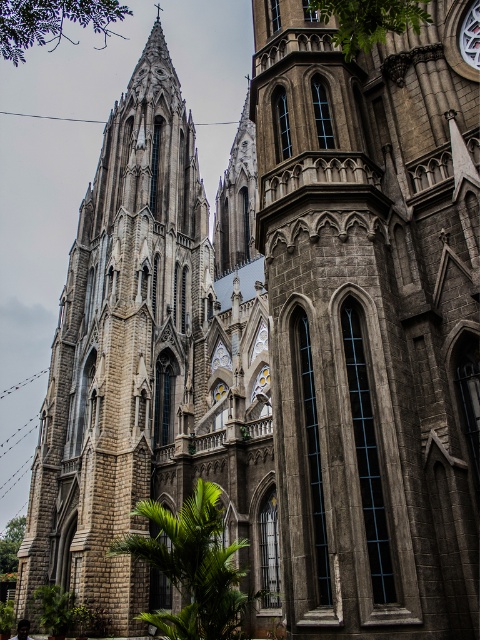
Does gray stone tower at center have a greater width compared to stone tower at left?

In fact, gray stone tower at center might be narrower than stone tower at left.

Does gray stone tower at center have a lesser height compared to stone tower at left?

Indeed, gray stone tower at center has a lesser height compared to stone tower at left.

Who is more distant from viewer, (266, 196) or (180, 100)?

Positioned behind is point (180, 100).

Find the location of a particular element. The height and width of the screenshot is (640, 480). gray stone tower at center is located at coordinates (372, 323).